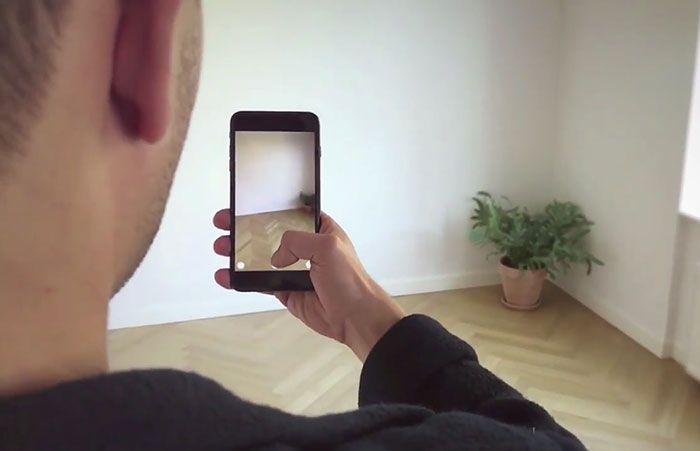
Where is `potted plant`? The height and width of the screenshot is (451, 700). potted plant is located at coordinates (514, 241).